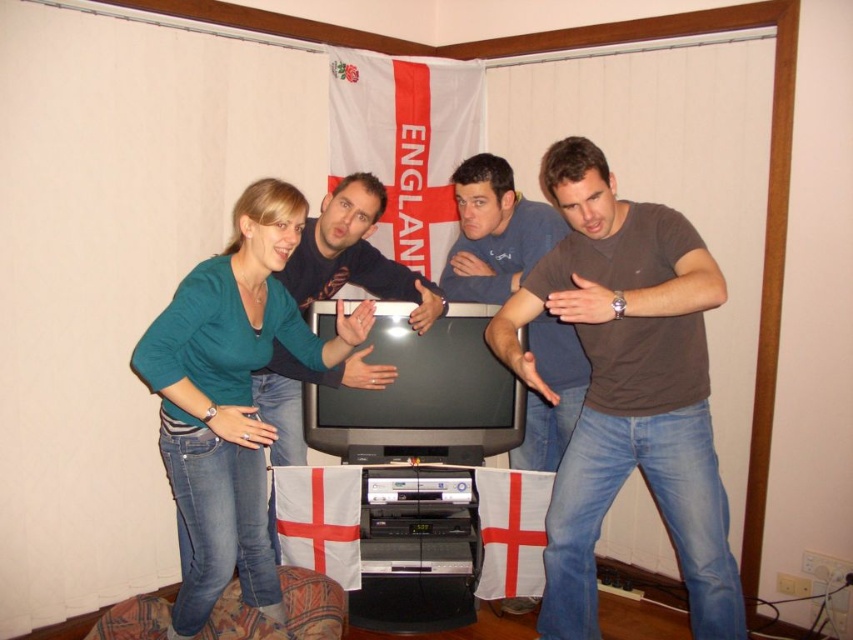
Question: Among these points, which one is nearest to the camera?

Choices:
 (A) (502, 326)
 (B) (146, 356)
 (C) (259, 413)

Answer: (B)

Question: Does green matte shirt at center come behind dark brown t-shirt at center?

Choices:
 (A) no
 (B) yes

Answer: (A)

Question: Can you confirm if green matte shirt at center is positioned above dark brown t-shirt at center?

Choices:
 (A) no
 (B) yes

Answer: (A)

Question: Among these points, which one is nearest to the camera?

Choices:
 (A) (287, 406)
 (B) (564, 324)
 (C) (596, 500)

Answer: (C)

Question: Which object appears closest to the camera in this image?

Choices:
 (A) green matte shirt at center
 (B) dark brown t-shirt at center

Answer: (A)

Question: Does green matte shirt at center have a smaller size compared to dark blue shirt at center?

Choices:
 (A) yes
 (B) no

Answer: (A)